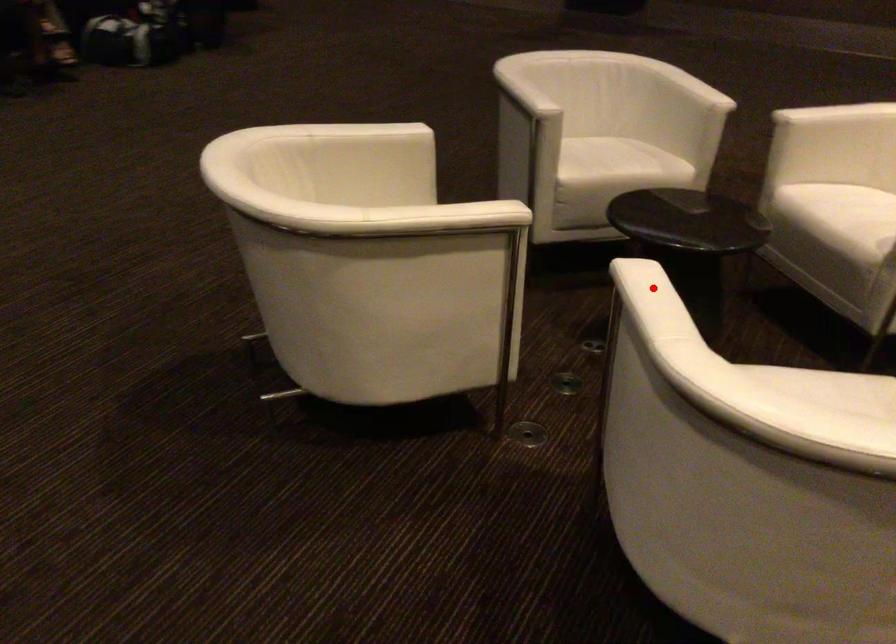
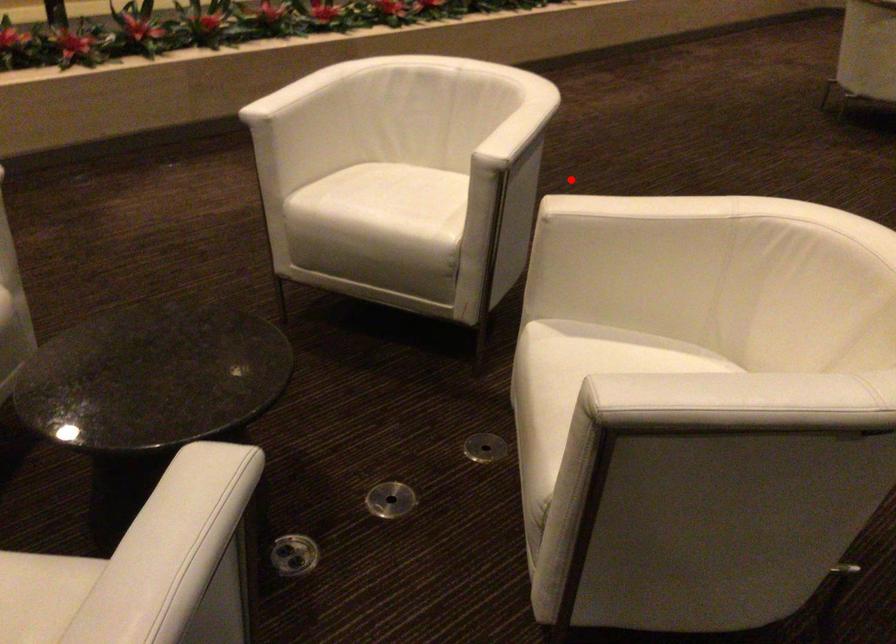
I am providing you with two images of the same scene from different viewpoints. A red point is marked on the first image and another point is marked on the second image. Do the highlighted points in image1 and image2 indicate the same real-world spot?

No